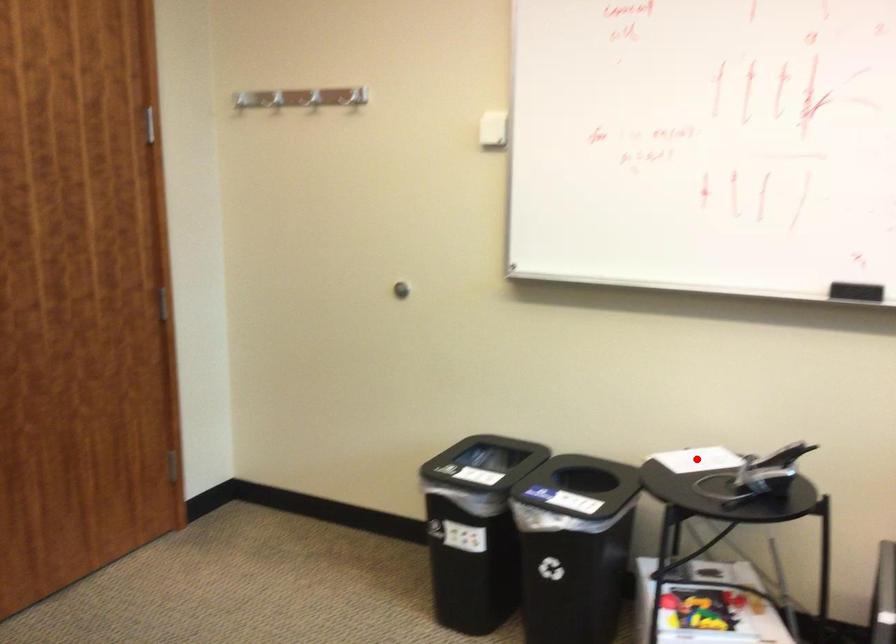
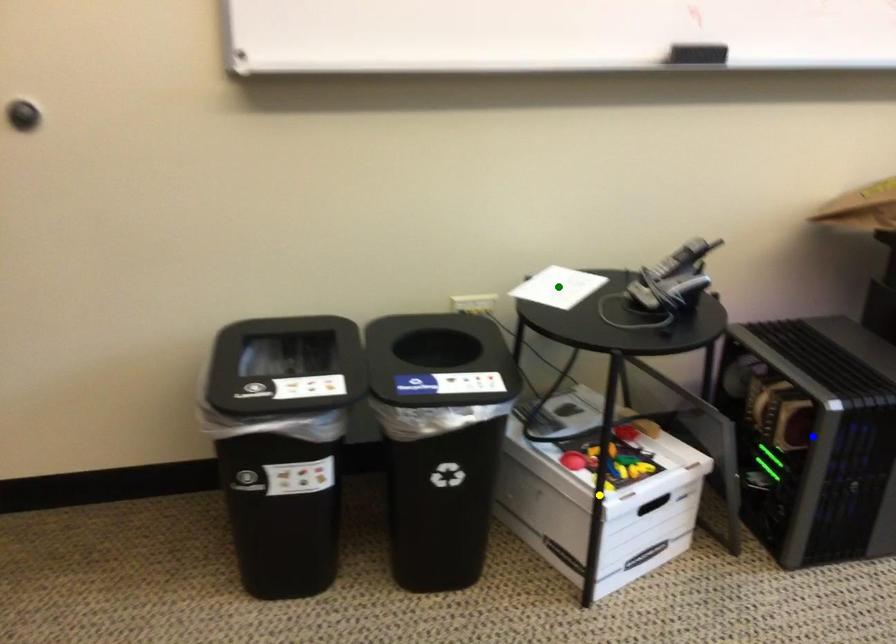
Question: I am providing you with two images of the same scene from different viewpoints. A red point is marked on the first image. You are given multiple points on the second image. Which point in image 2 represents the same 3d spot as the red point in image 1?

Choices:
 (A) green point
 (B) yellow point
 (C) blue point

Answer: (A)